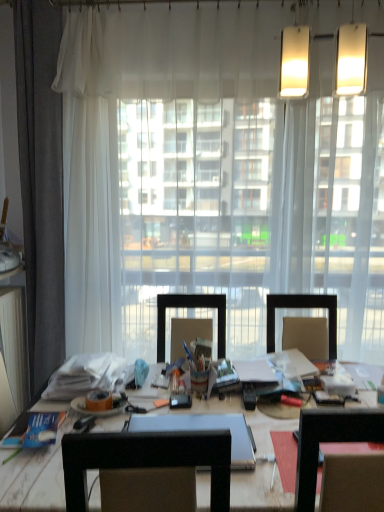
This screenshot has height=512, width=384. What are the coordinates of `vacant space to the right of orange matte adhesive tape at center` in the screenshot? It's located at (147, 402).